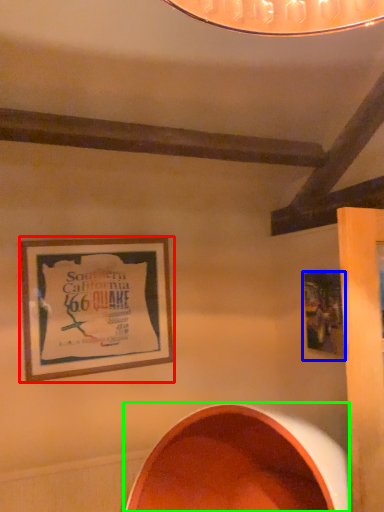
Question: Based on their relative distances, which object is farther from picture frame (highlighted by a red box)? Choose from picture frame (highlighted by a blue box) and oval (highlighted by a green box).

Choices:
 (A) picture frame
 (B) oval

Answer: (A)